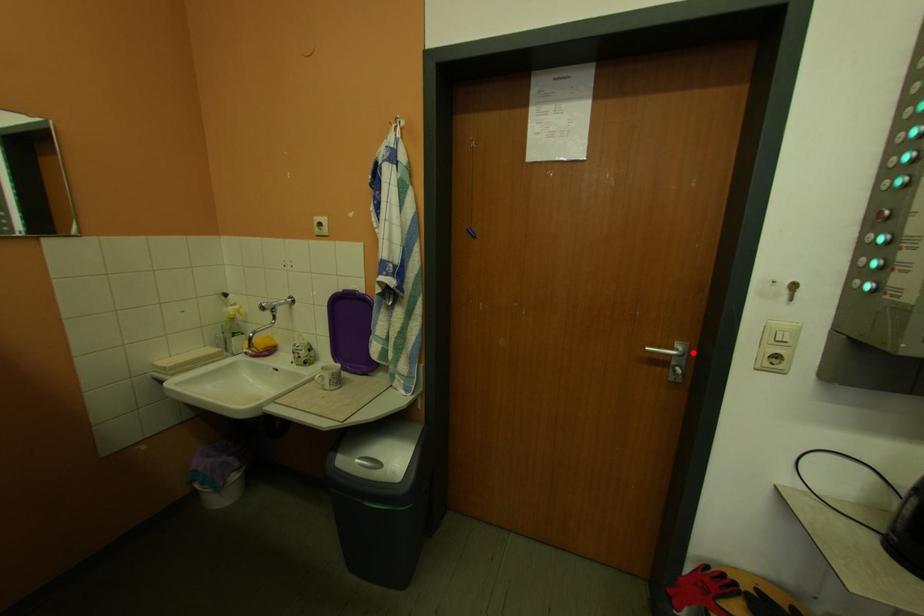
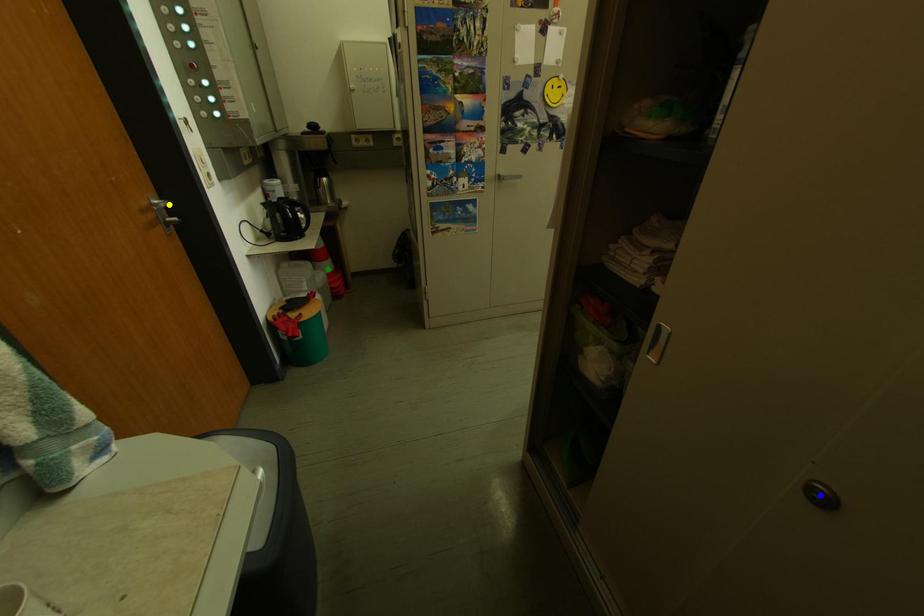
Question: I am providing you with two images of the same scene from different viewpoints. A red point is marked on the first image. You are given multiple points on the second image. Can you choose the point in image 2 that corresponds to the point in image 1?

Choices:
 (A) green point
 (B) yellow point
 (C) blue point

Answer: (B)